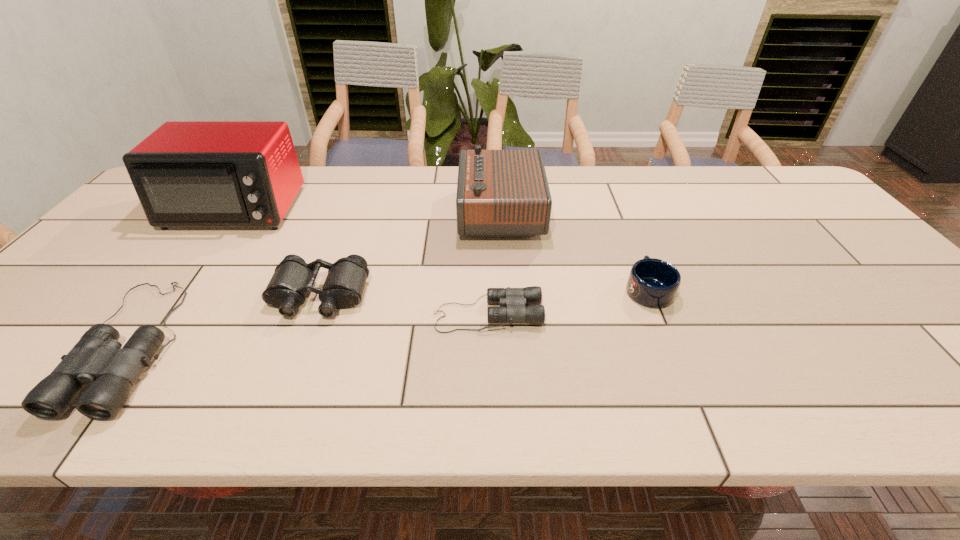
Where is `vacant space located on the front panel of the radio receiver`? The height and width of the screenshot is (540, 960). vacant space located on the front panel of the radio receiver is located at coordinates (373, 213).

The width and height of the screenshot is (960, 540). Identify the location of vacant area situated 0.190m on the front-facing side of the toaster oven. [180, 284].

Identify the location of free space located through the eyepieces of the second binoculars from left to right. (294, 365).

This screenshot has width=960, height=540. In order to click on vacant space situated with the handle on the side of the mug in this screenshot , I will do `click(624, 230)`.

In order to click on vacant point located 0.120m with the handle on the side of the mug in this screenshot , I will do `click(629, 243)`.

I want to click on free space located with the handle on the side of the mug, so click(x=612, y=200).

Image resolution: width=960 pixels, height=540 pixels. I want to click on radio receiver present at the far edge, so click(x=500, y=193).

The width and height of the screenshot is (960, 540). I want to click on toaster oven at the far edge, so click(x=186, y=173).

This screenshot has width=960, height=540. I want to click on object present at the near edge, so click(x=97, y=358).

Where is `object that is at the left edge`? Image resolution: width=960 pixels, height=540 pixels. object that is at the left edge is located at coordinates (186, 173).